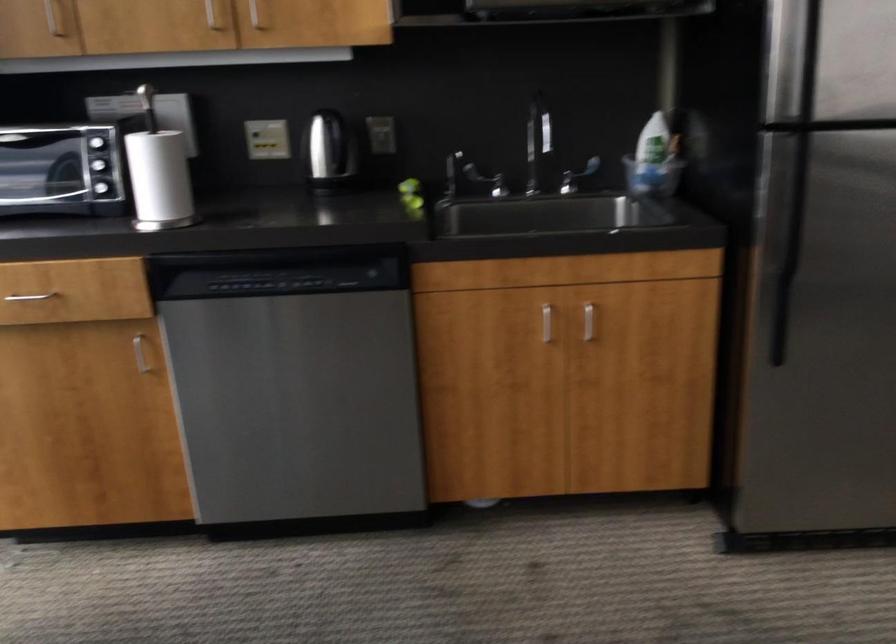
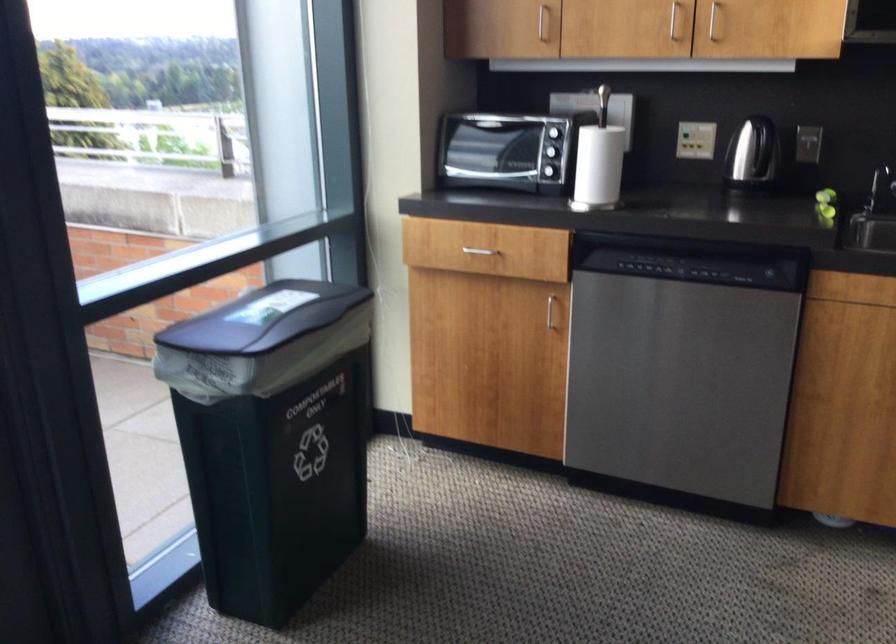
In the second image, find the point that corresponds to point (268, 144) in the first image.

(695, 140)